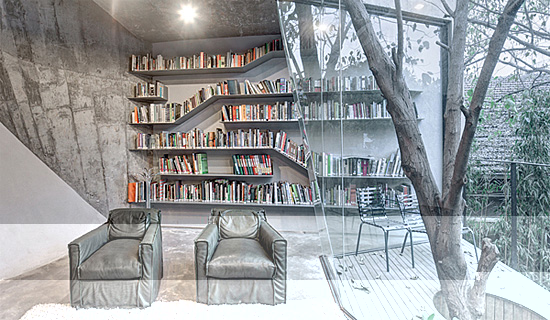
Locate an element on the screen. The image size is (550, 320). ceiling is located at coordinates (250, 19).